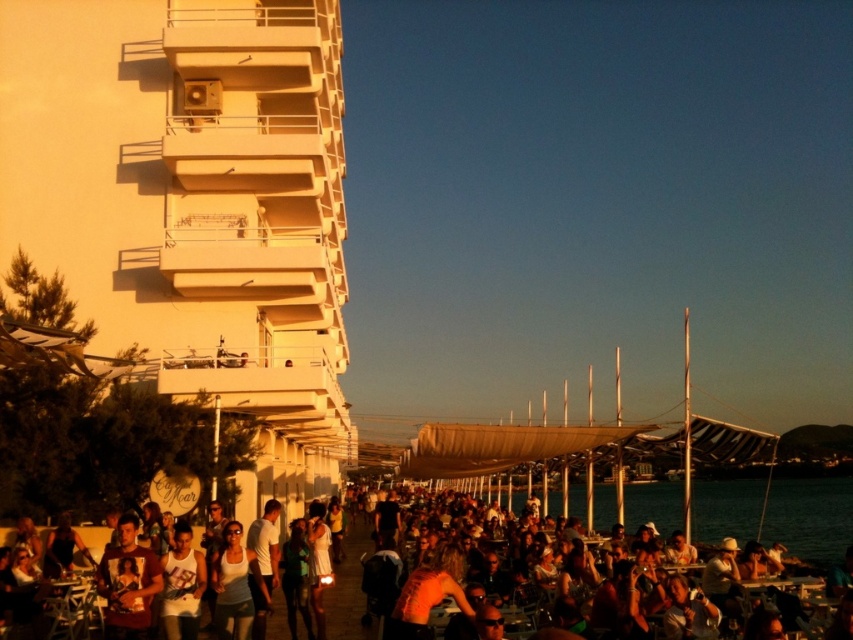
Is orange tank top at center positioned in front of white matte tank top at center?

No.

Is point (811, 525) positioned before point (229, 524)?

No, it is behind (229, 524).

I want to click on orange tank top at center, so click(778, 509).